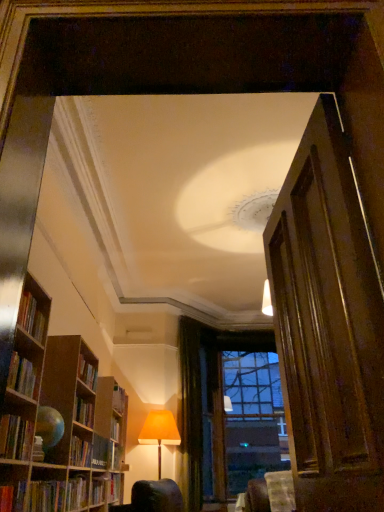
Question: From a real-world perspective, is hardcover book at lower left, the 4th book from the top, above or below hardcover book at left, marked as the fifth book in a back-to-front arrangement?

Choices:
 (A) below
 (B) above

Answer: (A)

Question: Does point (3, 499) appear closer or farther from the camera than point (18, 438)?

Choices:
 (A) farther
 (B) closer

Answer: (B)

Question: Which of these objects is positioned closest to the hardcover book at lower left, which is the 5th book from front to back?

Choices:
 (A) wooden door at right
 (B) clear glass window at center
 (C) hardcover book at lower left, arranged as the fourth book when viewed from the front
 (D) green velvet curtain at center
 (E) wooden bookcase at left

Answer: (C)

Question: Estimate the real-world distances between objects in this image. Which object is closer to the hardcover book at left, arranged as the third book when viewed from the front?

Choices:
 (A) clear glass window at center
 (B) hardcover book at left, the 2th book in the front-to-back sequence
 (C) hardcover book at left, marked as the fifth book in a back-to-front arrangement
 (D) orange fabric lampshade at lower center
 (E) wooden bookcase at left

Answer: (C)